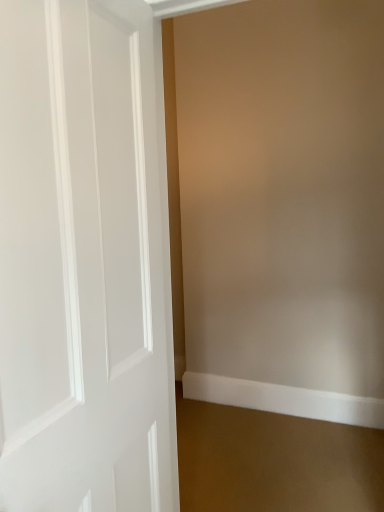
Question: From the image's perspective, is white smooth baseboard at lower right located above or below white glossy door at left?

Choices:
 (A) below
 (B) above

Answer: (A)

Question: Based on their positions, is white smooth baseboard at lower right located to the left or right of white glossy door at left?

Choices:
 (A) right
 (B) left

Answer: (A)

Question: In terms of width, does white smooth baseboard at lower right look wider or thinner when compared to white glossy door at left?

Choices:
 (A) wide
 (B) thin

Answer: (B)

Question: Considering their positions, is white glossy door at left located in front of or behind white smooth baseboard at lower right?

Choices:
 (A) behind
 (B) front

Answer: (B)

Question: Considering the relative positions of white glossy door at left and white smooth baseboard at lower right in the image provided, is white glossy door at left to the left or to the right of white smooth baseboard at lower right?

Choices:
 (A) right
 (B) left

Answer: (B)

Question: Looking at their shapes, would you say white glossy door at left is wider or thinner than white smooth baseboard at lower right?

Choices:
 (A) thin
 (B) wide

Answer: (B)

Question: From the image's perspective, is white glossy door at left located above or below white smooth baseboard at lower right?

Choices:
 (A) above
 (B) below

Answer: (A)